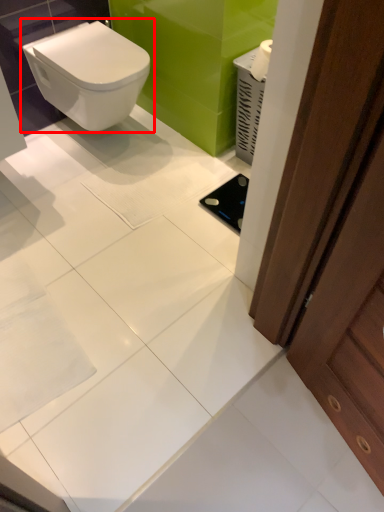
Question: From the image's perspective, what is the correct spatial relationship of toilet (annotated by the red box) in relation to screen door?

Choices:
 (A) above
 (B) below

Answer: (A)